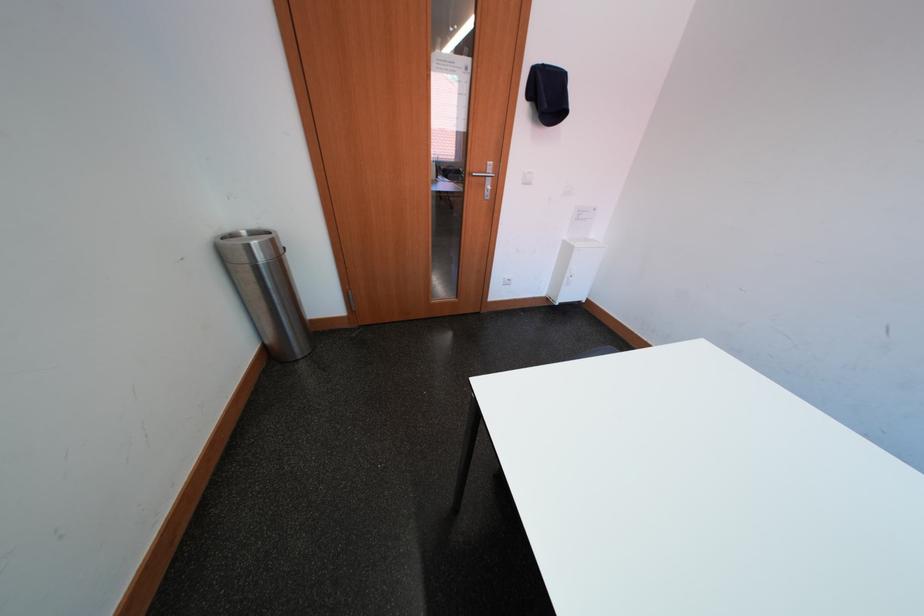
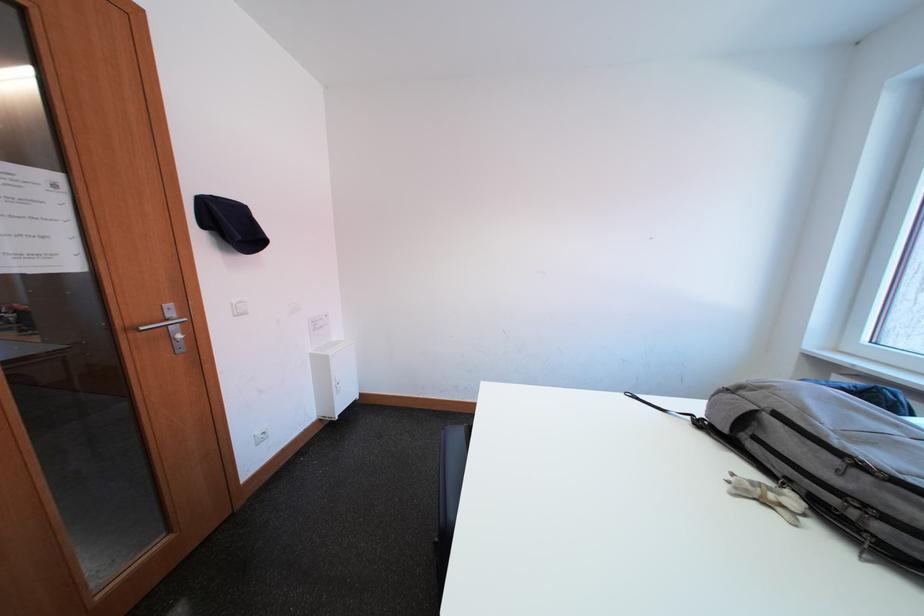
Question: The first image is from the beginning of the video and the second image is from the end. How did the camera likely rotate when shooting the video?

Choices:
 (A) Left
 (B) Right
 (C) Up
 (D) Down

Answer: (B)